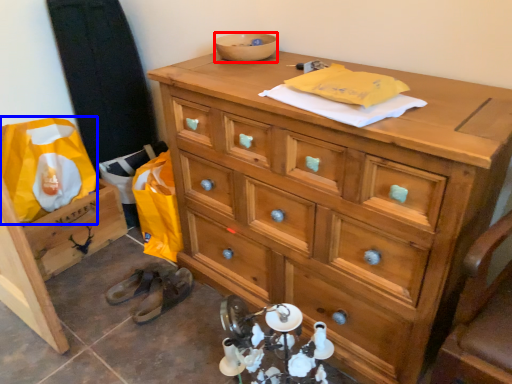
Question: Which of the following is the farthest to the observer, bowl (highlighted by a red box) or material (highlighted by a blue box)?

Choices:
 (A) bowl
 (B) material

Answer: (B)